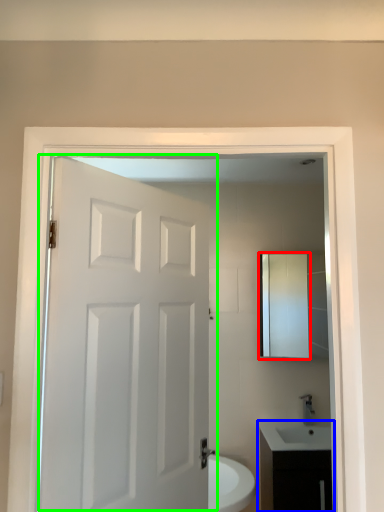
Question: Estimate the real-world distances between objects in this image. Which object is farther from medicine cabinet (highlighted by a red box), bathroom cabinet (highlighted by a blue box) or door (highlighted by a green box)?

Choices:
 (A) bathroom cabinet
 (B) door

Answer: (B)